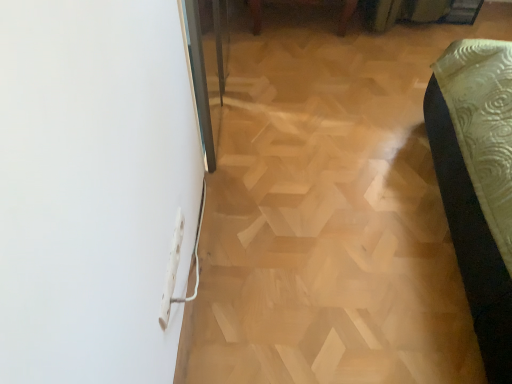
Question: Visually, is light wood parquet floor at center positioned to the left or to the right of white plastic electric outlet at lower left?

Choices:
 (A) right
 (B) left

Answer: (A)

Question: Is light wood parquet floor at center wider or thinner than white plastic electric outlet at lower left?

Choices:
 (A) thin
 (B) wide

Answer: (B)

Question: Is point (290, 344) positioned closer to the camera than point (166, 284)?

Choices:
 (A) farther
 (B) closer

Answer: (A)

Question: Relative to light wood parquet floor at center, is white plastic electric outlet at lower left in front or behind?

Choices:
 (A) behind
 (B) front

Answer: (B)

Question: Is white plastic electric outlet at lower left taller or shorter than light wood parquet floor at center?

Choices:
 (A) short
 (B) tall

Answer: (B)

Question: From the image's perspective, is white plastic electric outlet at lower left above or below light wood parquet floor at center?

Choices:
 (A) above
 (B) below

Answer: (B)

Question: From a real-world perspective, is white plastic electric outlet at lower left above or below light wood parquet floor at center?

Choices:
 (A) above
 (B) below

Answer: (A)